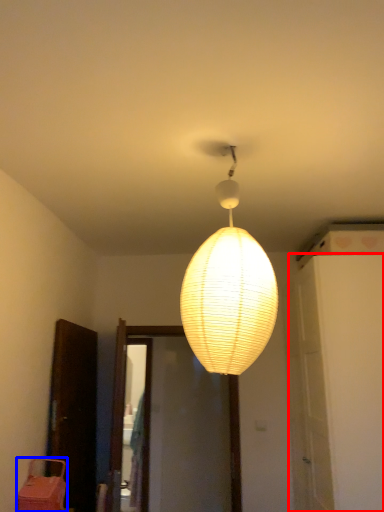
Question: Which object is closer to the camera taking this photo, door (highlighted by a red box) or furniture (highlighted by a blue box)?

Choices:
 (A) door
 (B) furniture

Answer: (B)